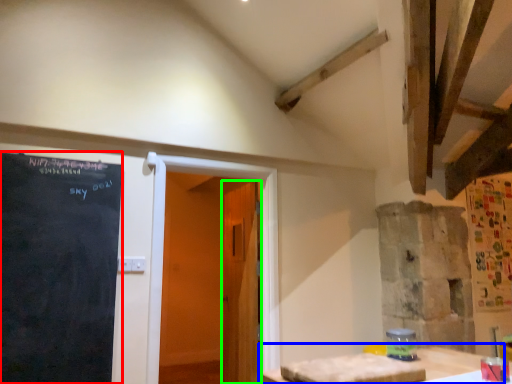
Question: Which object is positioned closest to blackboard (highlighted by a red box)? Select from table (highlighted by a blue box) and door (highlighted by a green box).

Choices:
 (A) table
 (B) door

Answer: (B)